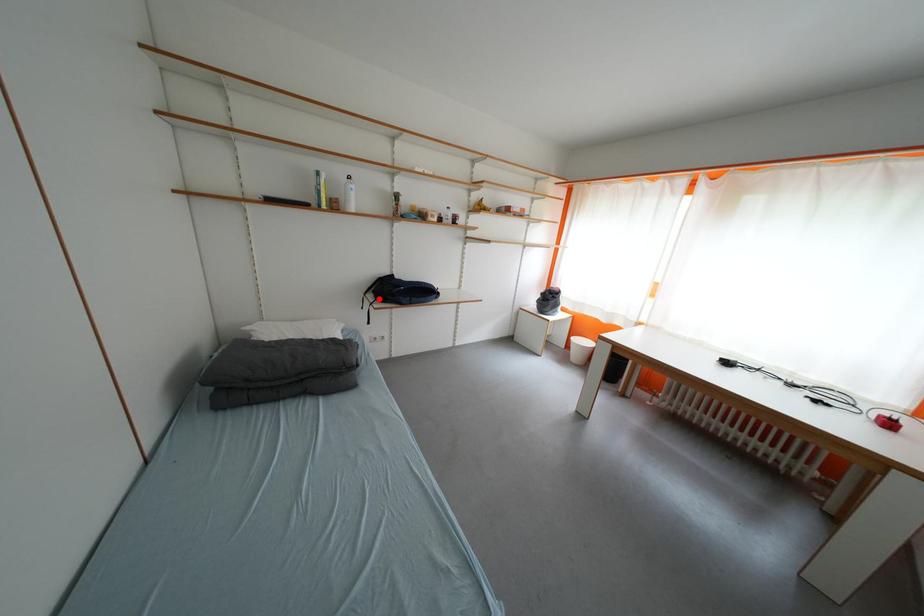
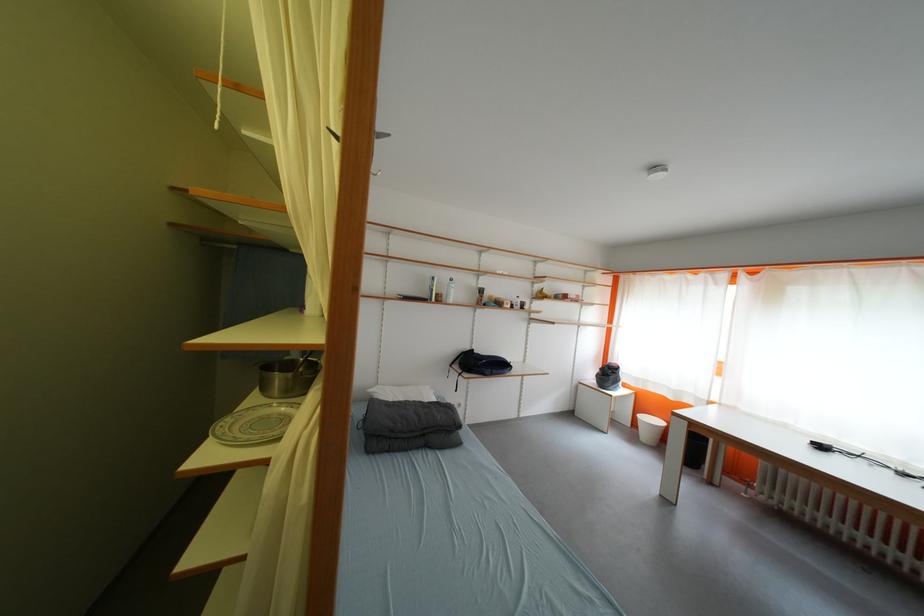
The point at the highlighted location is marked in the first image. Where is the corresponding point in the second image?

(466, 370)